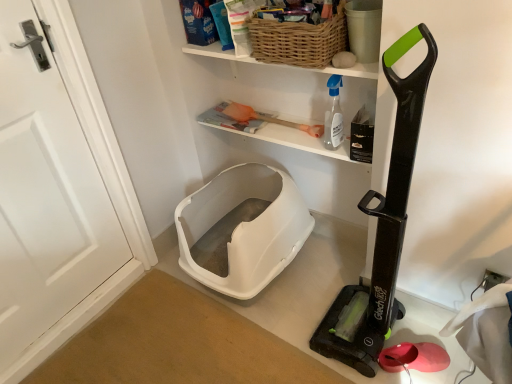
Question: Is white plastic litter box at lower center outside transparent plastic spray bottle at upper center?

Choices:
 (A) yes
 (B) no

Answer: (A)

Question: Considering the relative sizes of white plastic litter box at lower center and transparent plastic spray bottle at upper center in the image provided, is white plastic litter box at lower center bigger than transparent plastic spray bottle at upper center?

Choices:
 (A) no
 (B) yes

Answer: (B)

Question: From a real-world perspective, is white plastic litter box at lower center on transparent plastic spray bottle at upper center?

Choices:
 (A) no
 (B) yes

Answer: (A)

Question: From the image's perspective, is white plastic litter box at lower center over transparent plastic spray bottle at upper center?

Choices:
 (A) no
 (B) yes

Answer: (A)

Question: From a real-world perspective, is white plastic litter box at lower center under transparent plastic spray bottle at upper center?

Choices:
 (A) yes
 (B) no

Answer: (A)

Question: Is black plastic vacuum cleaner at right bigger or smaller than woven wood shelf at upper center?

Choices:
 (A) big
 (B) small

Answer: (A)

Question: From a real-world perspective, is black plastic vacuum cleaner at right above or below woven wood shelf at upper center?

Choices:
 (A) below
 (B) above

Answer: (A)

Question: Choose the correct answer: Is black plastic vacuum cleaner at right inside woven wood shelf at upper center or outside it?

Choices:
 (A) inside
 (B) outside

Answer: (B)

Question: From the image's perspective, is black plastic vacuum cleaner at right located above or below woven wood shelf at upper center?

Choices:
 (A) below
 (B) above

Answer: (A)

Question: Is black plastic vacuum cleaner at right wider or thinner than white plastic litter box at lower center?

Choices:
 (A) thin
 (B) wide

Answer: (A)

Question: From the image's perspective, relative to white plastic litter box at lower center, is black plastic vacuum cleaner at right above or below?

Choices:
 (A) above
 (B) below

Answer: (A)

Question: Visually, is black plastic vacuum cleaner at right positioned to the left or to the right of white plastic litter box at lower center?

Choices:
 (A) left
 (B) right

Answer: (B)

Question: From their relative heights in the image, would you say black plastic vacuum cleaner at right is taller or shorter than white plastic litter box at lower center?

Choices:
 (A) tall
 (B) short

Answer: (A)

Question: From a real-world perspective, is black plastic vacuum cleaner at right physically located above or below woven brown basket at upper center?

Choices:
 (A) below
 (B) above

Answer: (A)

Question: In terms of width, does black plastic vacuum cleaner at right look wider or thinner when compared to woven brown basket at upper center?

Choices:
 (A) thin
 (B) wide

Answer: (B)